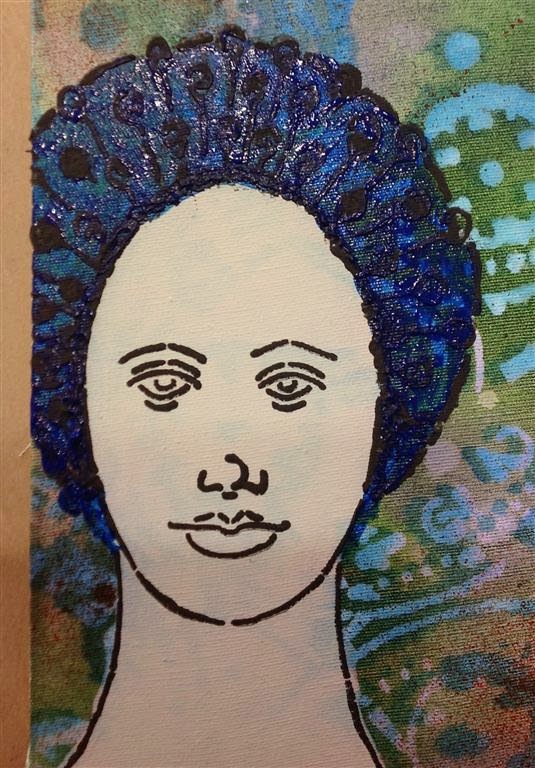
Where is `canvas`? Image resolution: width=535 pixels, height=768 pixels. canvas is located at coordinates (402, 91).